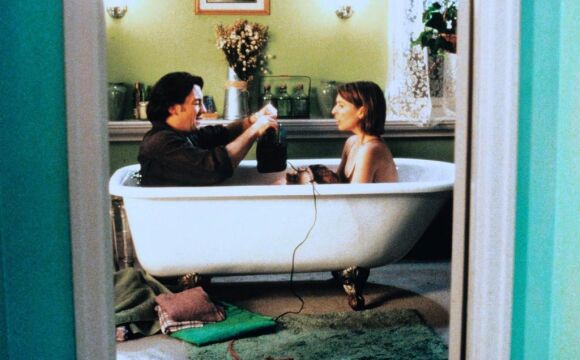
Identify the location of green towel. (233, 322).